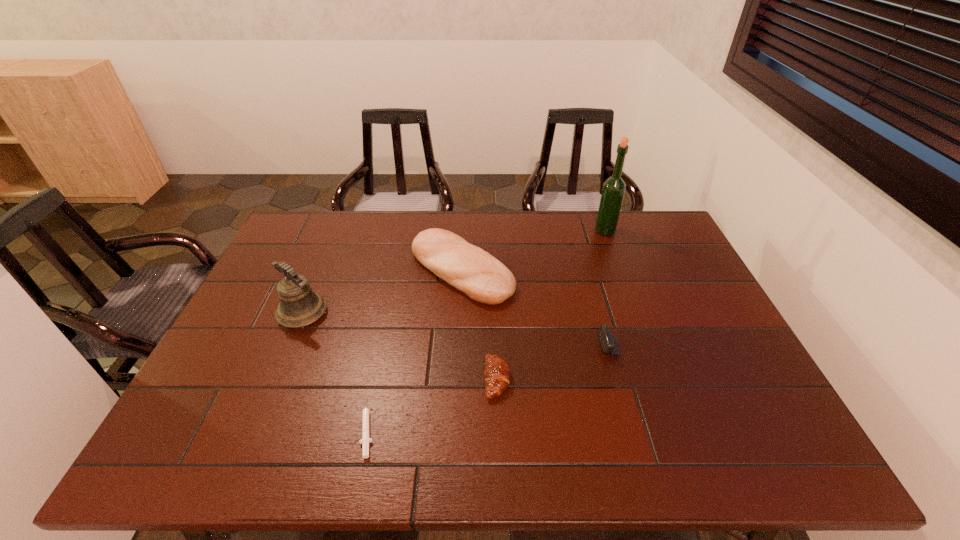
This screenshot has width=960, height=540. In order to click on object that is at the left edge in this screenshot , I will do `click(299, 306)`.

Where is `object located at the right edge`? object located at the right edge is located at coordinates (608, 341).

This screenshot has width=960, height=540. In the image, there is a desktop. Identify the location of blank space at the far edge. (340, 231).

What are the coordinates of `vacant space at the near edge of the desktop` in the screenshot? It's located at (647, 434).

The width and height of the screenshot is (960, 540). In order to click on free space at the left edge of the desktop in this screenshot , I will do pyautogui.click(x=260, y=367).

This screenshot has height=540, width=960. Identify the location of vacant space at the right edge of the desktop. (734, 414).

Where is `blank space at the far left corner`? The image size is (960, 540). blank space at the far left corner is located at coordinates (320, 245).

The height and width of the screenshot is (540, 960). I want to click on vacant region at the far right corner of the desktop, so click(x=656, y=228).

Image resolution: width=960 pixels, height=540 pixels. In order to click on free space between the second shortest object and the tallest object in this screenshot , I will do `click(551, 305)`.

Locate an element on the screen. vacant area that lies between the fifth shortest object and the fifth object from right to left is located at coordinates (335, 370).